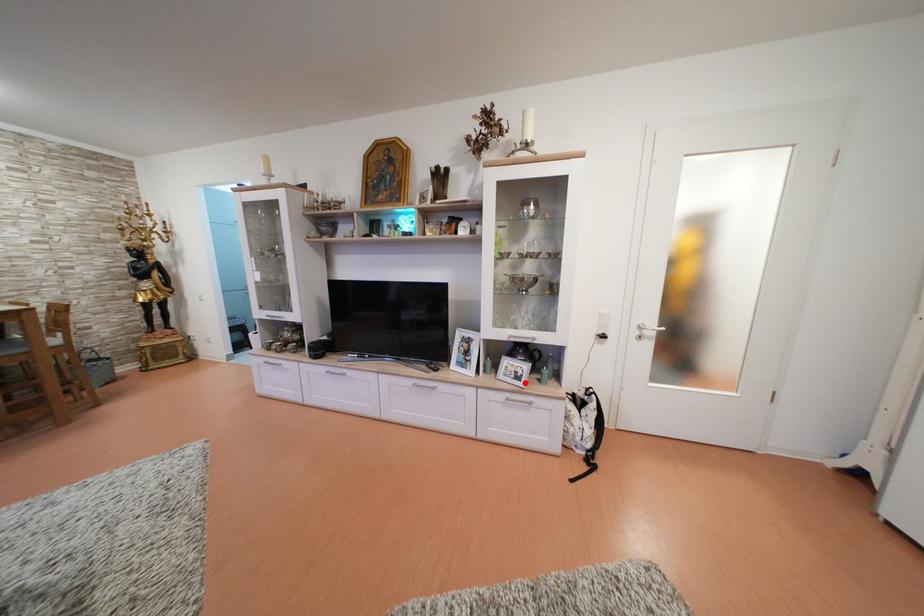
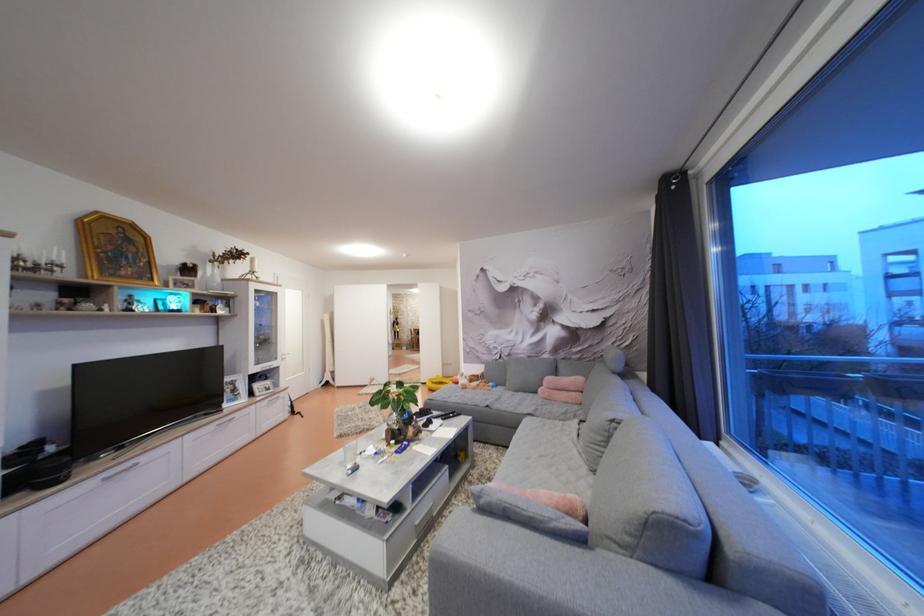
Question: I am providing you with two images of the same scene from different viewpoints. A red point is shown in image1. For the corresponding object point in image2, is it positioned nearer or farther from the camera?

Choices:
 (A) Nearer
 (B) Farther

Answer: (A)